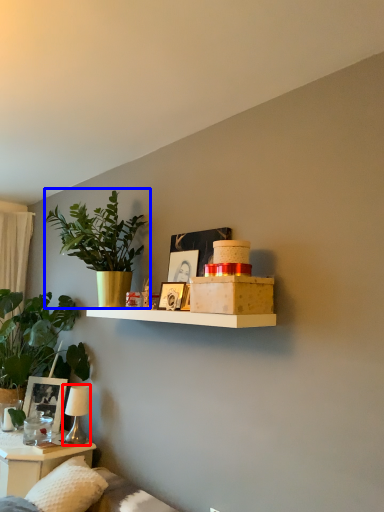
Question: Which object appears closest to the camera in this image, table lamp (highlighted by a red box) or houseplant (highlighted by a blue box)?

Choices:
 (A) table lamp
 (B) houseplant

Answer: (B)